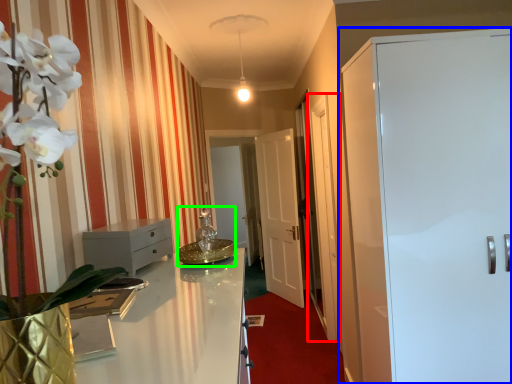
Question: Which object is positioned closest to glass door (highlighted by a red box)? Select from door (highlighted by a blue box) and sink (highlighted by a green box).

Choices:
 (A) door
 (B) sink

Answer: (A)